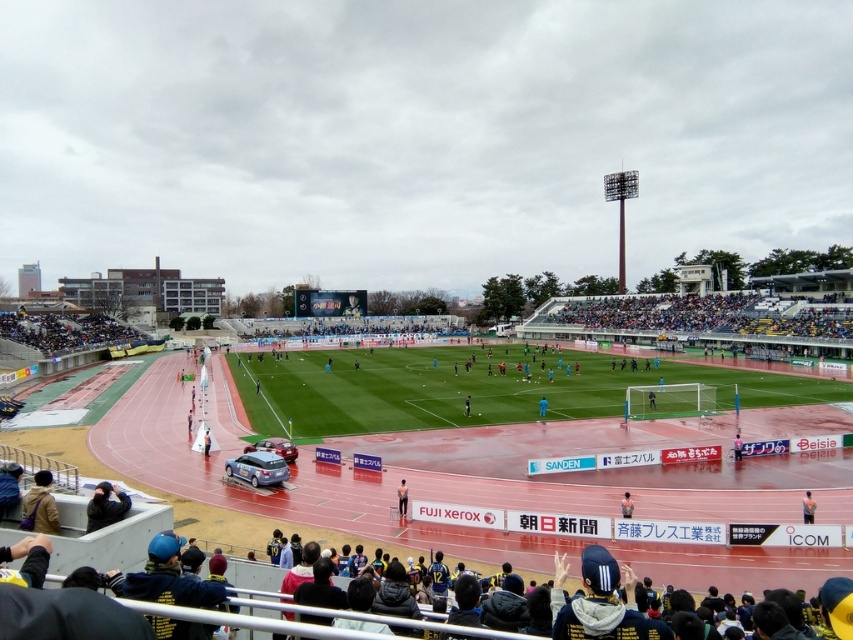
Is shiny silver car at center behind blue fabric person at center?

No.

Which of these two, shiny silver car at center or blue fabric person at center, stands shorter?

With less height is blue fabric person at center.

Where is `shiny silver car at center`? This screenshot has width=853, height=640. shiny silver car at center is located at coordinates pos(274,448).

The width and height of the screenshot is (853, 640). What are the coordinates of `shiny silver car at center` in the screenshot? It's located at (274, 448).

Between point (401, 512) and point (622, 515), which one is positioned behind?

Positioned behind is point (401, 512).

Is black fabric person at center below yellow uniformed person at center?

Actually, black fabric person at center is above yellow uniformed person at center.

Where is `black fabric person at center`? black fabric person at center is located at coordinates (402, 499).

Which is below, dark gray concrete crowd at lower left or shiny silver car at center?

Positioned lower is shiny silver car at center.

Is dark gray concrete crowd at lower left closer to the viewer compared to shiny silver car at center?

No, it is behind shiny silver car at center.

Locate an element on the screen. This screenshot has height=640, width=853. dark gray concrete crowd at lower left is located at coordinates (65, 332).